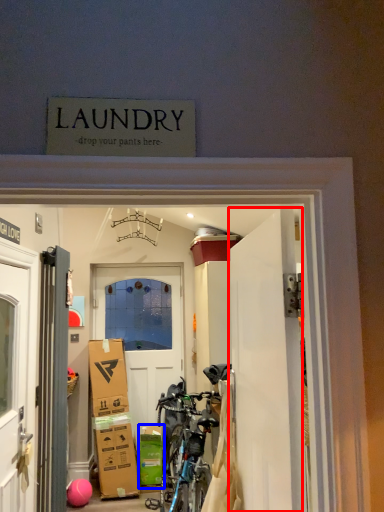
Question: Which object is closer to the camera taking this photo, door (highlighted by a red box) or cardboard box (highlighted by a blue box)?

Choices:
 (A) door
 (B) cardboard box

Answer: (A)